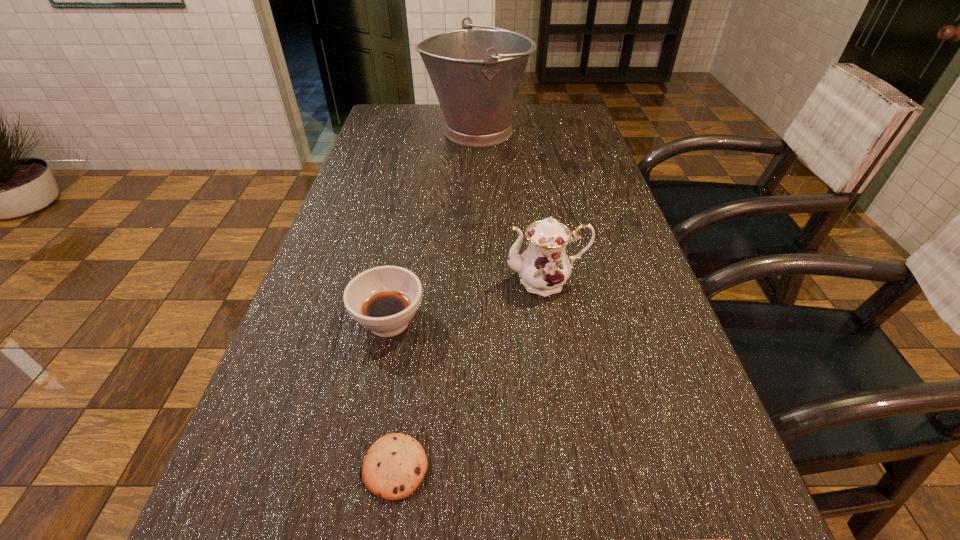
Identify the location of vacant space in between the chinaware and the third tallest object. (468, 301).

Where is `unoccupied position between the third tallest object and the tallest object`? unoccupied position between the third tallest object and the tallest object is located at coordinates (433, 227).

Find the location of `object that stands as the third closest to the shortest object`. object that stands as the third closest to the shortest object is located at coordinates (384, 299).

Locate which object ranks third in proximity to the second nearest object. Please provide its 2D coordinates. Your answer should be formatted as a tuple, i.e. [(x, y)], where the tuple contains the x and y coordinates of a point satisfying the conditions above.

[(544, 267)]

The height and width of the screenshot is (540, 960). I want to click on blank space that satisfies the following two spatial constraints: 1. on the front side of the second shortest object; 2. on the right side of the third tallest object, so click(360, 467).

Identify the location of free space that satisfies the following two spatial constraints: 1. on the back side of the soup bowl; 2. on the right side of the tallest object. (427, 132).